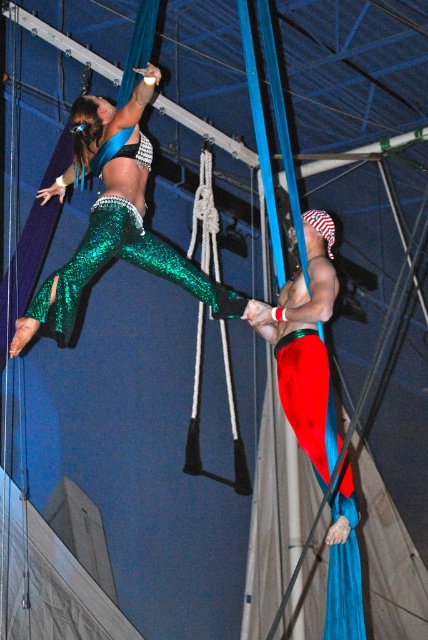
Looking at this image, is shiny green sequined pants at center in front of red fabric pants at center?

Yes, shiny green sequined pants at center is closer to the viewer.

Locate an element on the screen. This screenshot has height=640, width=428. shiny green sequined pants at center is located at coordinates (116, 221).

The image size is (428, 640). Find the location of `shiny green sequined pants at center`. shiny green sequined pants at center is located at coordinates (116, 221).